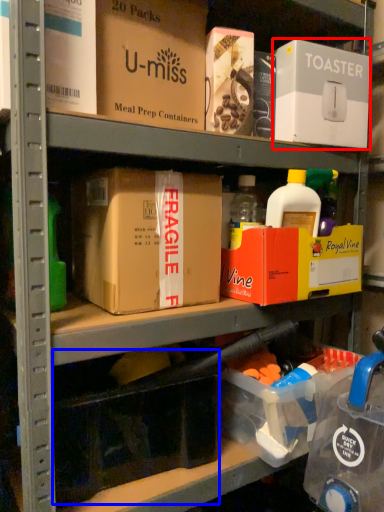
Question: Which object is closer to the camera taking this photo, box (highlighted by a red box) or storage box (highlighted by a blue box)?

Choices:
 (A) box
 (B) storage box

Answer: (B)